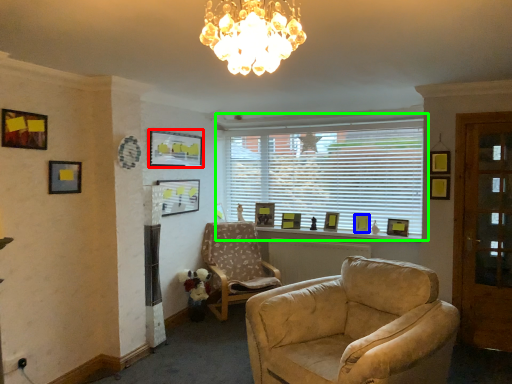
Question: Estimate the real-world distances between objects in this image. Which object is closer to picture frame (highlighted by a red box), picture frame (highlighted by a blue box) or window (highlighted by a green box)?

Choices:
 (A) picture frame
 (B) window

Answer: (B)